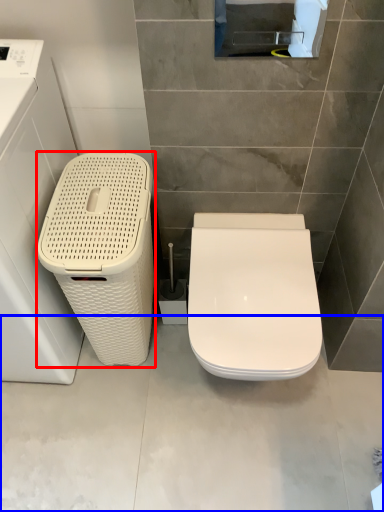
Question: Which object appears closest to the camera in this image, dish washer (highlighted by a red box) or concrete (highlighted by a blue box)?

Choices:
 (A) dish washer
 (B) concrete

Answer: (A)